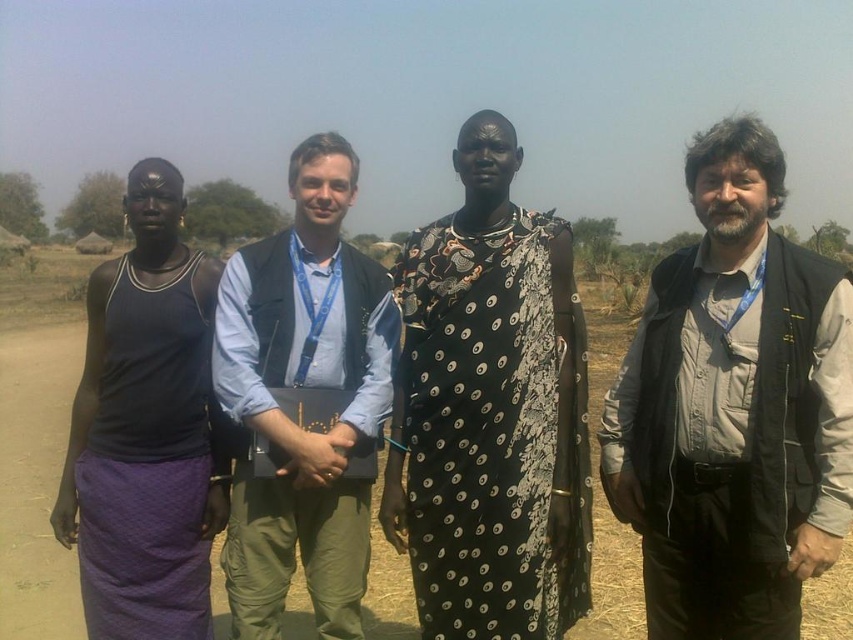
This screenshot has height=640, width=853. What do you see at coordinates (303, 387) in the screenshot?
I see `blue fabric vest at center` at bounding box center [303, 387].

Which is in front, point (312, 369) or point (630, 632)?

Point (312, 369) is more forward.

Find the location of a particular element. Image resolution: width=853 pixels, height=640 pixels. blue fabric vest at center is located at coordinates (303, 387).

Based on the photo, is gray fabric vest at center positioned before brown dirt field at center?

Yes, gray fabric vest at center is closer to the viewer.

Between point (672, 497) and point (74, 380), which one is positioned behind?

The point (74, 380) is more distant.

The image size is (853, 640). I want to click on gray fabric vest at center, so click(x=734, y=406).

Between blue fabric vest at center and purple fabric skirt at left, which one has less height?

blue fabric vest at center is shorter.

Can you confirm if blue fabric vest at center is positioned to the left of purple fabric skirt at left?

No, blue fabric vest at center is not to the left of purple fabric skirt at left.

The height and width of the screenshot is (640, 853). Describe the element at coordinates (303, 387) in the screenshot. I see `blue fabric vest at center` at that location.

You are a GUI agent. You are given a task and a screenshot of the screen. Output one action in this format:
    pyautogui.click(x=<x>, y=<y>)
    Task: Click on the blue fabric vest at center
    This screenshot has height=640, width=853.
    Given the screenshot: What is the action you would take?
    pyautogui.click(x=303, y=387)